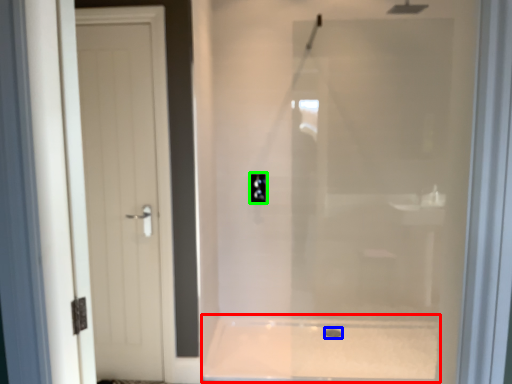
Question: Which object is the closest to the bath (highlighted by a red box)? Choose among these: drain (highlighted by a blue box) or electric outlet (highlighted by a green box).

Choices:
 (A) drain
 (B) electric outlet

Answer: (A)